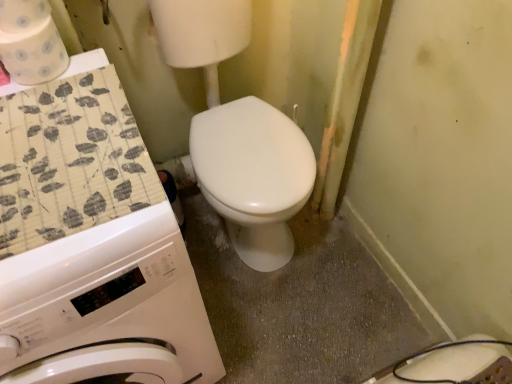
Where is `free space above white glossy washing machine at left (from a real-world perspective)`? The height and width of the screenshot is (384, 512). free space above white glossy washing machine at left (from a real-world perspective) is located at coordinates (52, 176).